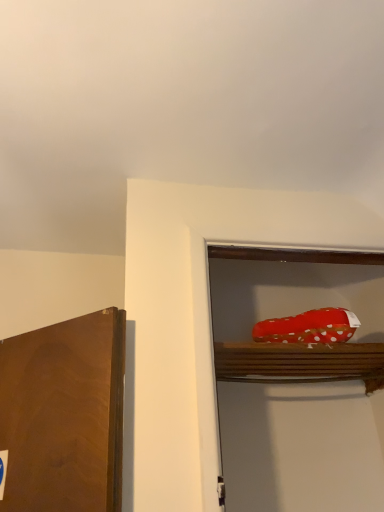
Describe the element at coordinates (309, 327) in the screenshot. Image resolution: width=384 pixels, height=512 pixels. I see `red polka dot fabric at upper right` at that location.

The height and width of the screenshot is (512, 384). In order to click on red polka dot fabric at upper right in this screenshot , I will do `click(309, 327)`.

Describe the element at coordinates (300, 362) in the screenshot. I see `polka dot fabric shoe at upper right` at that location.

At what (x,y) coordinates should I click in order to perform the action: click on polka dot fabric shoe at upper right. Please return your answer as a coordinate pair (x, y). This screenshot has height=512, width=384. Looking at the image, I should click on (300, 362).

Locate an element on the screen. This screenshot has width=384, height=512. red polka dot fabric at upper right is located at coordinates (309, 327).

Considering the positions of objects polka dot fabric shoe at upper right and red polka dot fabric at upper right in the image provided, who is more to the left, polka dot fabric shoe at upper right or red polka dot fabric at upper right?

Positioned to the left is red polka dot fabric at upper right.

Is polka dot fabric shoe at upper right positioned behind red polka dot fabric at upper right?

That is False.

Which point is more forward, [273,358] or [276,324]?

Point [276,324]

From the image's perspective, who appears lower, polka dot fabric shoe at upper right or red polka dot fabric at upper right?

polka dot fabric shoe at upper right is shown below in the image.

From a real-world perspective, does polka dot fabric shoe at upper right stand above red polka dot fabric at upper right?

No, from a real-world perspective, polka dot fabric shoe at upper right is not over red polka dot fabric at upper right

Is polka dot fabric shoe at upper right wider than red polka dot fabric at upper right?

Correct, the width of polka dot fabric shoe at upper right exceeds that of red polka dot fabric at upper right.

Based on the photo, is polka dot fabric shoe at upper right shorter than red polka dot fabric at upper right?

No.

Between polka dot fabric shoe at upper right and red polka dot fabric at upper right, which one has larger size?

Bigger between the two is polka dot fabric shoe at upper right.

Is polka dot fabric shoe at upper right located outside red polka dot fabric at upper right?

polka dot fabric shoe at upper right lies outside red polka dot fabric at upper right's area.

Are polka dot fabric shoe at upper right and red polka dot fabric at upper right making contact?

No, polka dot fabric shoe at upper right is not touching red polka dot fabric at upper right.

Is red polka dot fabric at upper right at the back of polka dot fabric shoe at upper right?

No.

What's the angular difference between polka dot fabric shoe at upper right and red polka dot fabric at upper right's facing directions?

polka dot fabric shoe at upper right and red polka dot fabric at upper right are facing 3.71 degrees away from each other.

How distant is polka dot fabric shoe at upper right from red polka dot fabric at upper right?

5.55 inches.

At what (x,y) coordinates should I click in order to perform the action: click on shelf lying on the right of red polka dot fabric at upper right. Please return your answer as a coordinate pair (x, y). Image resolution: width=384 pixels, height=512 pixels. Looking at the image, I should click on (300, 362).

Between red polka dot fabric at upper right and polka dot fabric shoe at upper right, which one appears on the left side from the viewer's perspective?

From the viewer's perspective, red polka dot fabric at upper right appears more on the left side.

Which object is closer to the camera, red polka dot fabric at upper right or polka dot fabric shoe at upper right?

polka dot fabric shoe at upper right is more forward.

Does point (320, 315) come in front of point (256, 347)?

No, (320, 315) is further to viewer.

From the image's perspective, which is above, red polka dot fabric at upper right or polka dot fabric shoe at upper right?

red polka dot fabric at upper right.

From a real-world perspective, which is physically above, red polka dot fabric at upper right or polka dot fabric shoe at upper right?

red polka dot fabric at upper right, from a real-world perspective.

Which of these two, red polka dot fabric at upper right or polka dot fabric shoe at upper right, is wider?

With larger width is polka dot fabric shoe at upper right.

Does red polka dot fabric at upper right have a lesser height compared to polka dot fabric shoe at upper right?

Correct, red polka dot fabric at upper right is not as tall as polka dot fabric shoe at upper right.

Which of these two, red polka dot fabric at upper right or polka dot fabric shoe at upper right, is smaller?

red polka dot fabric at upper right is smaller.

Is red polka dot fabric at upper right situated inside polka dot fabric shoe at upper right or outside?

red polka dot fabric at upper right is located beyond the bounds of polka dot fabric shoe at upper right.

Is there a large distance between red polka dot fabric at upper right and polka dot fabric shoe at upper right?

They are positioned close to each other.

Could you tell me if red polka dot fabric at upper right is facing polka dot fabric shoe at upper right?

No, red polka dot fabric at upper right is not turned towards polka dot fabric shoe at upper right.

Can you tell me how much red polka dot fabric at upper right and polka dot fabric shoe at upper right differ in facing direction?

The facing directions of red polka dot fabric at upper right and polka dot fabric shoe at upper right are 3.71 degrees apart.

You are a GUI agent. You are given a task and a screenshot of the screen. Output one action in this format:
    pyautogui.click(x=<x>, y=<y>)
    Task: Click on the shelf on the right of red polka dot fabric at upper right
    
    Given the screenshot: What is the action you would take?
    pyautogui.click(x=300, y=362)

The width and height of the screenshot is (384, 512). In order to click on shelf directly beneath the red polka dot fabric at upper right (from a real-world perspective) in this screenshot , I will do `click(300, 362)`.

Locate an element on the screen. Image resolution: width=384 pixels, height=512 pixels. shelf that is in front of the red polka dot fabric at upper right is located at coordinates (300, 362).